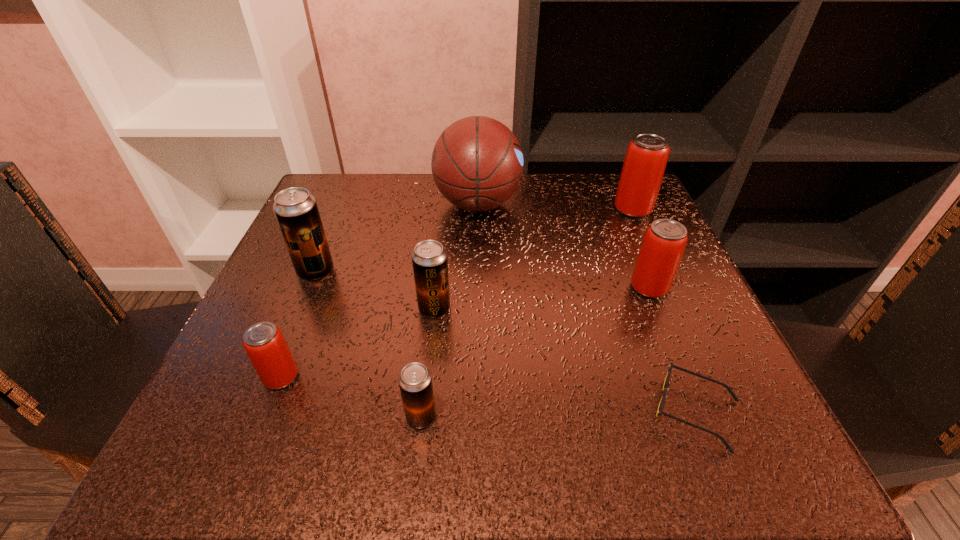
In order to click on vacant area that lies between the second biggest pink beer can and the leftmost pink beer can in this screenshot , I will do `click(466, 333)`.

The width and height of the screenshot is (960, 540). I want to click on free space between the sunglasses and the nearest black beer can, so click(x=559, y=414).

Find the location of `free space between the sunglasses and the nearest pink beer can`. free space between the sunglasses and the nearest pink beer can is located at coordinates (489, 394).

Identify the location of free space between the farthest beer can and the smallest black beer can. The image size is (960, 540). (527, 313).

I want to click on vacant area that lies between the nearest pink beer can and the tallest object, so click(x=379, y=291).

I want to click on the second closest object to the tallest object, so click(x=429, y=259).

Select which object is the fourth closest to the biggest black beer can. Please provide its 2D coordinates. Your answer should be formatted as a tuple, i.e. [(x, y)], where the tuple contains the x and y coordinates of a point satisfying the conditions above.

[(415, 381)]

Identify which beer can is the fifth closest to the black sunglasses. Please provide its 2D coordinates. Your answer should be formatted as a tuple, i.e. [(x, y)], where the tuple contains the x and y coordinates of a point satisfying the conditions above.

[(264, 343)]

Find the location of a particular element. The width and height of the screenshot is (960, 540). the closest beer can to the second biggest black beer can is located at coordinates (415, 381).

Identify which pink beer can is the nearest to the second farthest pink beer can. Please provide its 2D coordinates. Your answer should be formatted as a tuple, i.e. [(x, y)], where the tuple contains the x and y coordinates of a point satisfying the conditions above.

[(647, 154)]